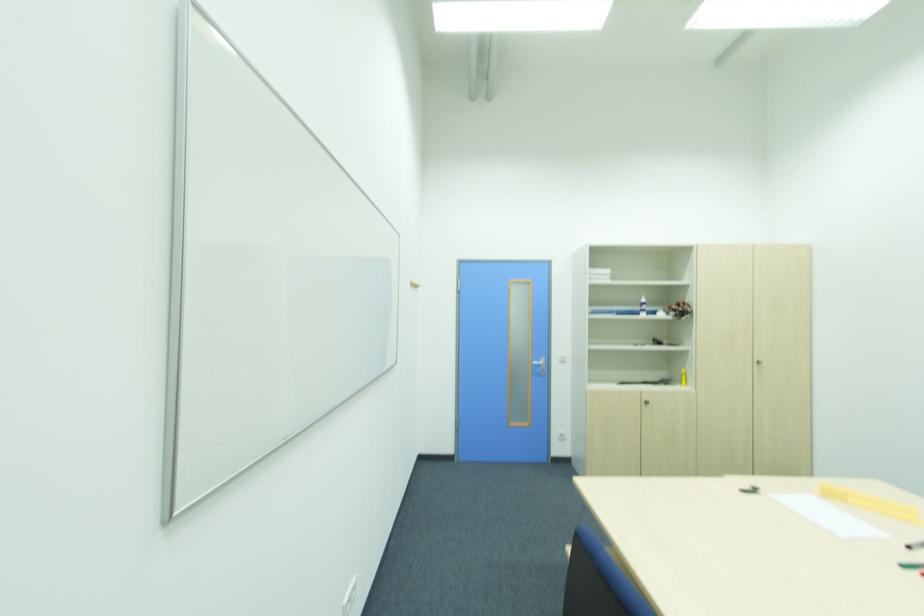
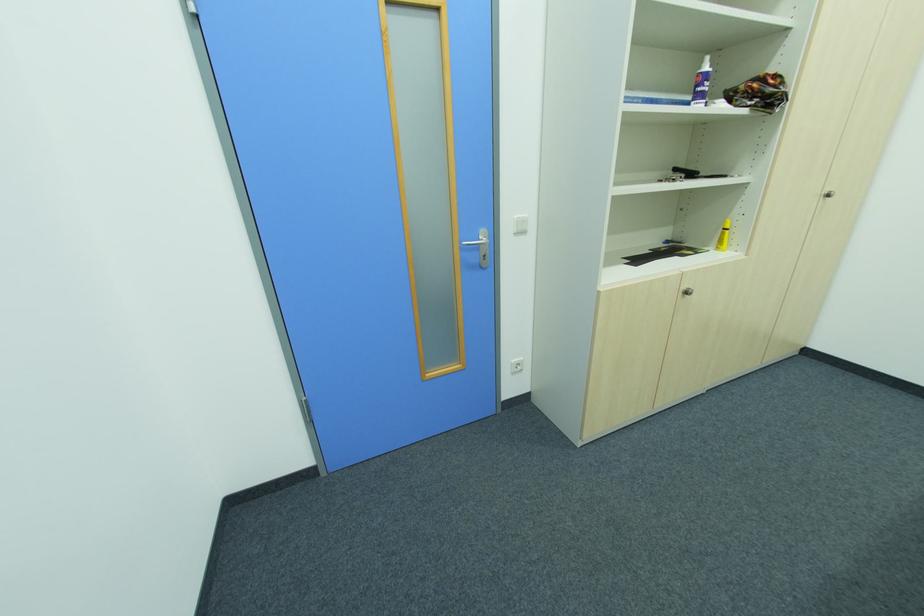
In the second image, find the point that corresponds to the point at 650,402 in the first image.

(689, 294)